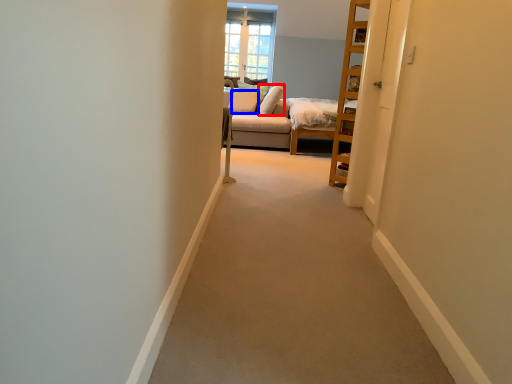
Question: Which object is closer to the camera taking this photo, pillow (highlighted by a red box) or pillow (highlighted by a blue box)?

Choices:
 (A) pillow
 (B) pillow

Answer: (A)